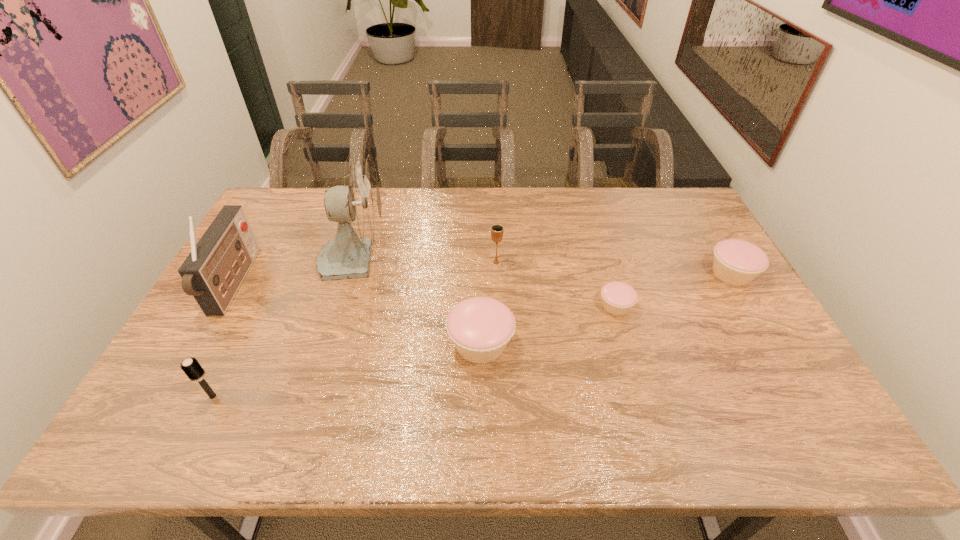
Identify the location of unoccupied area between the leftmost cupcake and the radio receiver. The height and width of the screenshot is (540, 960). (358, 314).

Image resolution: width=960 pixels, height=540 pixels. What are the coordinates of `empty space that is in between the rightmost cupcake and the second tallest object` in the screenshot? It's located at (483, 279).

Locate an element on the screen. The image size is (960, 540). free space between the leftmost object and the leftmost cupcake is located at coordinates (358, 314).

Image resolution: width=960 pixels, height=540 pixels. Identify the location of vacant space that is in between the fifth object from right to left and the sixth shortest object. (295, 271).

Find the location of a particular element. The width and height of the screenshot is (960, 540). empty space between the shortest cupcake and the second shortest object is located at coordinates (674, 290).

I want to click on vacant area that lies between the leftmost object and the leftmost cupcake, so click(358, 314).

Find the location of a particular element. The width and height of the screenshot is (960, 540). free space between the shortest cupcake and the farthest cupcake is located at coordinates (674, 290).

I want to click on the fourth closest object relative to the chalice, so click(x=736, y=262).

Locate which object is the second closest to the chalice. Please provide its 2D coordinates. Your answer should be formatted as a tuple, i.e. [(x, y)], where the tuple contains the x and y coordinates of a point satisfying the conditions above.

[(618, 298)]

Identify the location of cupcake that is the third closest to the chalice. (736, 262).